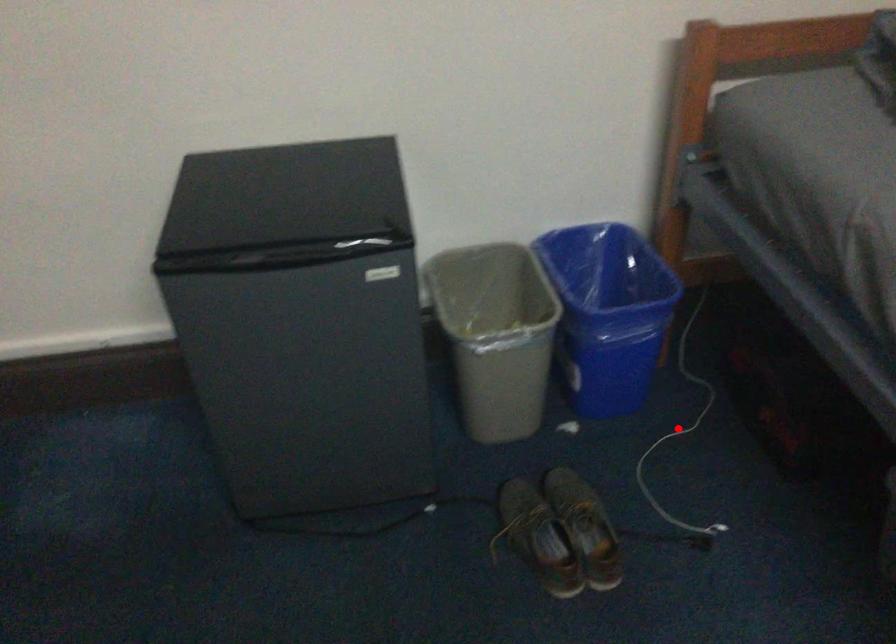
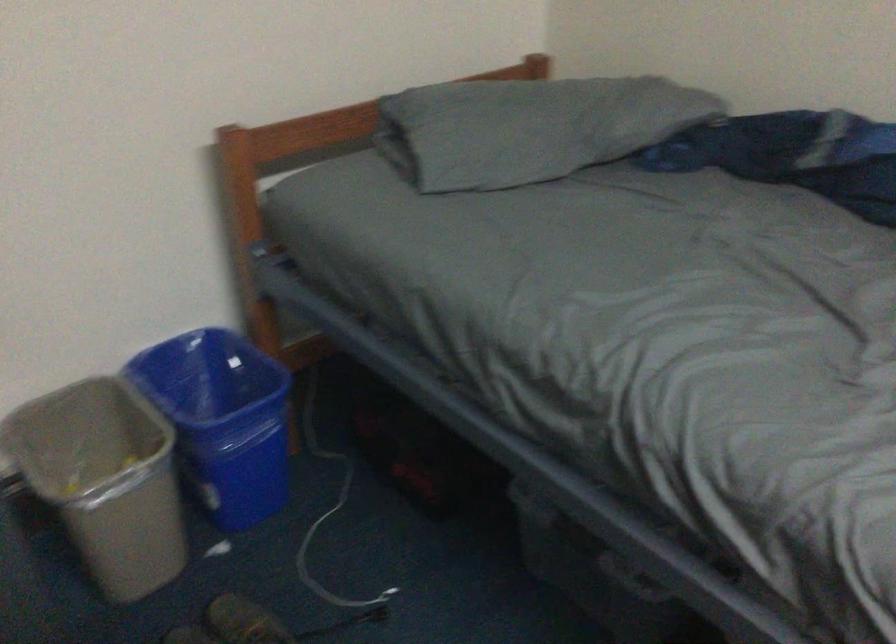
Question: I am providing you with two images of the same scene from different viewpoints. A red point is marked on the first image. At the location where the point appears in image 1, is it still visible in image 2?

Choices:
 (A) Yes
 (B) No

Answer: (A)